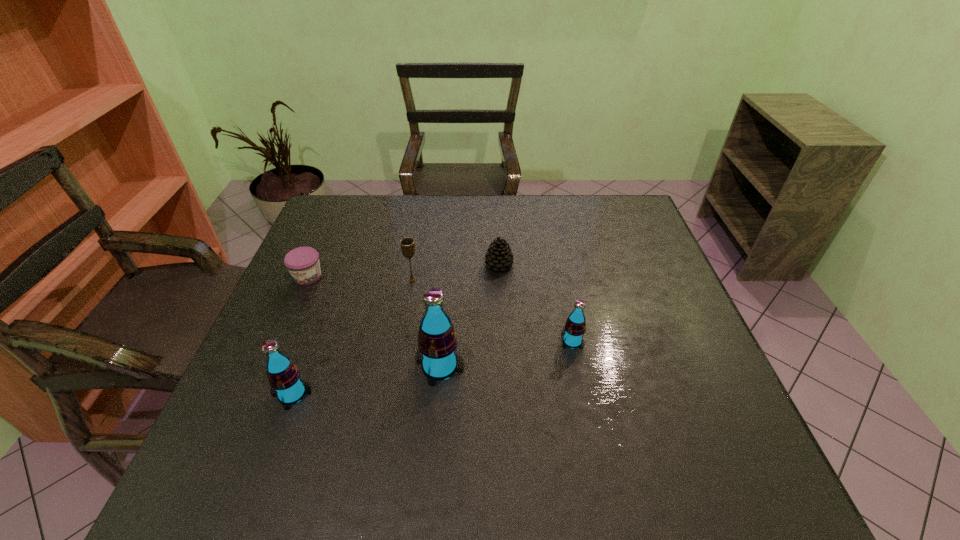
Where is `jam present at the left edge`? Image resolution: width=960 pixels, height=540 pixels. jam present at the left edge is located at coordinates (303, 263).

You are a GUI agent. You are given a task and a screenshot of the screen. Output one action in this format:
    pyautogui.click(x=<x>, y=<y>)
    Task: Click on the object situated at the near left corner
    
    Given the screenshot: What is the action you would take?
    pyautogui.click(x=284, y=377)

I want to click on vacant space at the far edge, so pyautogui.click(x=461, y=220).

In the image, there is a desktop. Identify the location of vacant space at the left edge. (318, 281).

I want to click on vacant space at the right edge of the desktop, so click(658, 292).

Where is `vacant space at the far left corner`? vacant space at the far left corner is located at coordinates (325, 206).

In the image, there is a desktop. What are the coordinates of `free space at the far right corner` in the screenshot? It's located at [608, 199].

Identify the location of vacant space that's between the third object from right to left and the shortest object. The width and height of the screenshot is (960, 540). (373, 321).

The image size is (960, 540). What are the coordinates of `vacant region between the rightmost object and the tallest object` in the screenshot? It's located at (506, 354).

Where is `free space between the second tallest soda and the third object from left to right`? The width and height of the screenshot is (960, 540). free space between the second tallest soda and the third object from left to right is located at coordinates (352, 337).